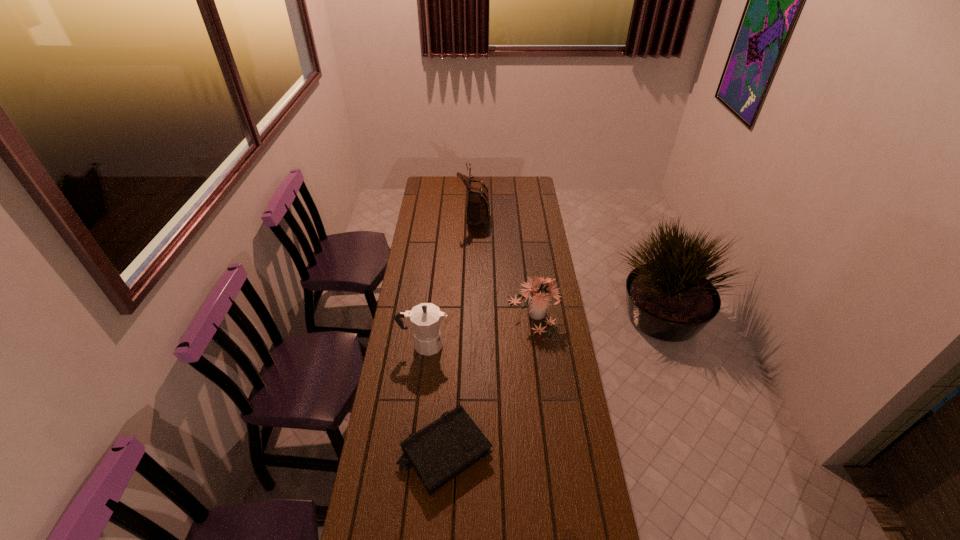
Where is `the farthest object`? the farthest object is located at coordinates (478, 209).

Identify the location of shoulder bag. (478, 209).

At what (x,y) coordinates should I click in order to perform the action: click on coffeepot. Please return your answer as a coordinate pair (x, y). The image size is (960, 540). Looking at the image, I should click on (426, 318).

The width and height of the screenshot is (960, 540). In order to click on bouquet in this screenshot , I will do `click(538, 297)`.

Where is `the shortest object`? The height and width of the screenshot is (540, 960). the shortest object is located at coordinates (439, 452).

Locate an element on the screen. the nearest object is located at coordinates click(x=439, y=452).

At what (x,y) coordinates should I click in order to perform the action: click on vacant space situated on the front-facing side of the farthest object. Please return your answer as a coordinate pair (x, y). The height and width of the screenshot is (540, 960). Looking at the image, I should click on (501, 214).

Locate an element on the screen. This screenshot has width=960, height=540. vacant point located at the spout of the coffeepot is located at coordinates (478, 344).

Image resolution: width=960 pixels, height=540 pixels. In order to click on vacant space located on the back of the rightmost object in this screenshot , I will do `click(529, 280)`.

What are the coordinates of `vacant space positioned on the back of the Bible` in the screenshot? It's located at (451, 356).